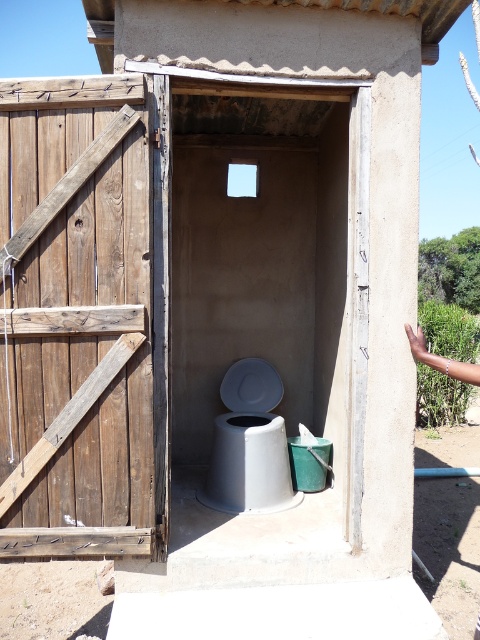
Between point (45, 141) and point (222, 508), which one is positioned behind?

Positioned behind is point (222, 508).

The height and width of the screenshot is (640, 480). Find the location of `weathered wood door at left`. weathered wood door at left is located at coordinates (83, 323).

Is wooden door at left closer to camera compared to white plastic toilet at center?

No, it is behind white plastic toilet at center.

Which is above, wooden door at left or white plastic toilet at center?

wooden door at left

I want to click on wooden door at left, so click(x=271, y=269).

In the scene shown: Can you confirm if weathered wood door at left is bigger than wooden door at left?

Incorrect, weathered wood door at left is not larger than wooden door at left.

Which is above, weathered wood door at left or wooden door at left?

wooden door at left

Is point (40, 259) farther from camera compared to point (356, 448)?

No.

What are the coordinates of `weathered wood door at left` in the screenshot? It's located at click(83, 323).